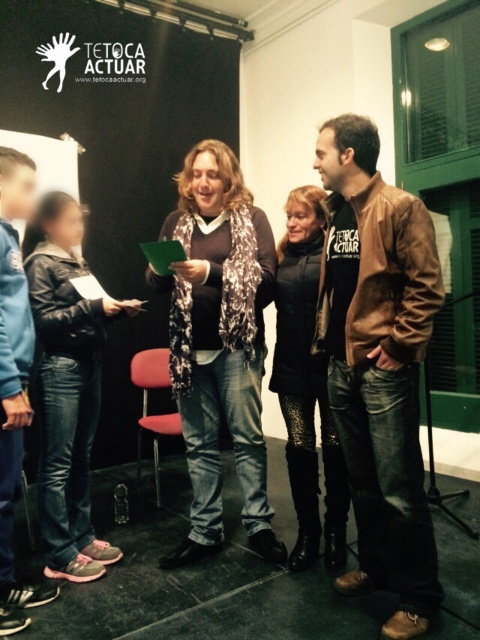
In the scene shown: Is brown leather jacket at center shorter than metallic red chair at center?

No, brown leather jacket at center is not shorter than metallic red chair at center.

Who is shorter, brown leather jacket at center or metallic red chair at center?

With less height is metallic red chair at center.

The image size is (480, 640). I want to click on brown leather jacket at center, so click(379, 364).

Where is `brown leather jacket at center`? The height and width of the screenshot is (640, 480). brown leather jacket at center is located at coordinates (379, 364).

Between brown leather jacket at center and matte black jacket at center, which one has less height?

With less height is matte black jacket at center.

Is brown leather jacket at center thinner than matte black jacket at center?

Correct, brown leather jacket at center's width is less than matte black jacket at center's.

I want to click on brown leather jacket at center, so click(x=379, y=364).

Between point (294, 412) and point (4, 212), which one is positioned behind?

The point (294, 412) is behind.

Is black quilted jacket at center positioned in front of blue fleece jacket at lower left?

That is False.

What do you see at coordinates (307, 385) in the screenshot? I see `black quilted jacket at center` at bounding box center [307, 385].

Locate an element on the screen. black quilted jacket at center is located at coordinates (307, 385).